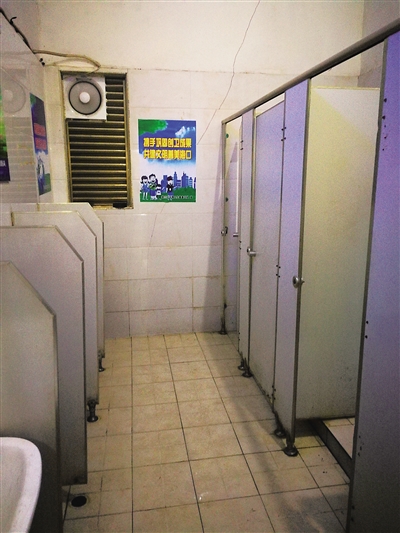
You are a GUI agent. You are given a task and a screenshot of the screen. Output one action in this format:
    pyautogui.click(x=<x>, y=<y>)
    Task: Click on the wall
    Image resolution: width=400 pixels, height=533 pixels.
    Given the screenshot: What is the action you would take?
    pyautogui.click(x=182, y=260)